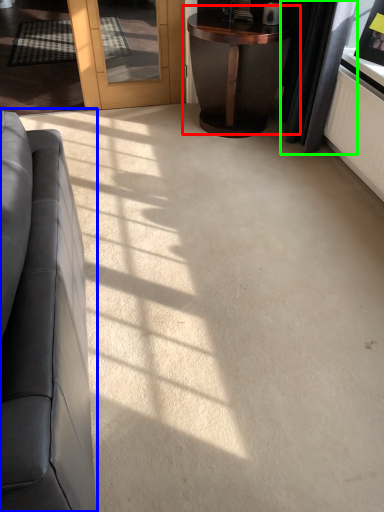
Question: Which is farther away from table (highlighted by a red box)? studio couch (highlighted by a blue box) or curtain (highlighted by a green box)?

Choices:
 (A) studio couch
 (B) curtain

Answer: (A)